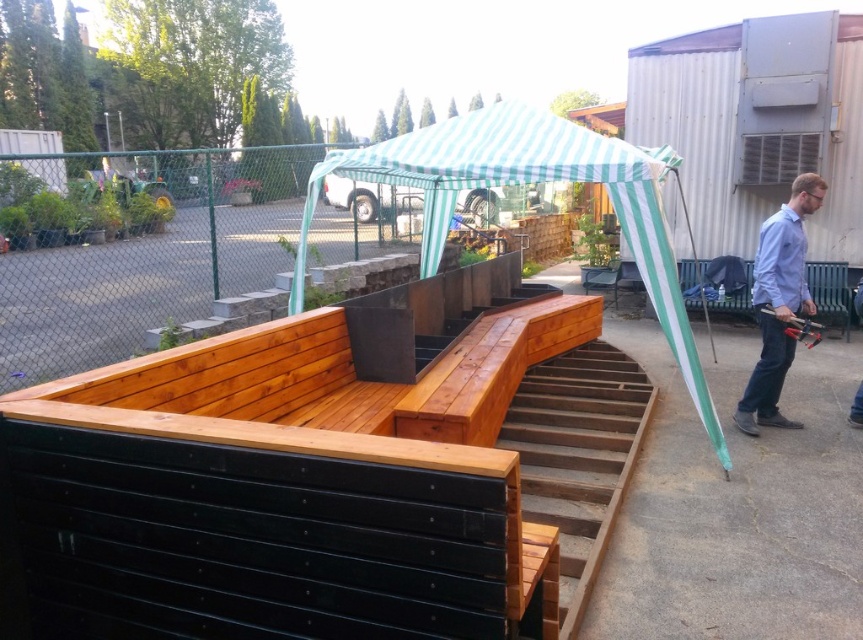
Can you confirm if wooden stairs at lower right is wider than light blue shirt at right?

Correct, the width of wooden stairs at lower right exceeds that of light blue shirt at right.

Can you confirm if wooden stairs at lower right is positioned above light blue shirt at right?

No, wooden stairs at lower right is not above light blue shirt at right.

Where is `wooden stairs at lower right`? The image size is (863, 640). wooden stairs at lower right is located at coordinates (578, 456).

Does point (413, 161) come closer to viewer compared to point (773, 378)?

That is True.

Consider the image. Is green striped canopy at center to the right of light blue shirt at right from the viewer's perspective?

Incorrect, green striped canopy at center is not on the right side of light blue shirt at right.

Is point (669, 332) farther from viewer compared to point (740, 426)?

No, it is not.

The width and height of the screenshot is (863, 640). I want to click on green striped canopy at center, so click(531, 182).

Who is positioned more to the left, green striped canopy at center or wooden stairs at lower right?

green striped canopy at center

Is point (433, 221) farther from camera compared to point (556, 502)?

Yes, point (433, 221) is behind point (556, 502).

Between point (644, 243) and point (528, 378), which one is positioned behind?

Positioned behind is point (528, 378).

Locate an element on the screen. The image size is (863, 640). green striped canopy at center is located at coordinates (531, 182).